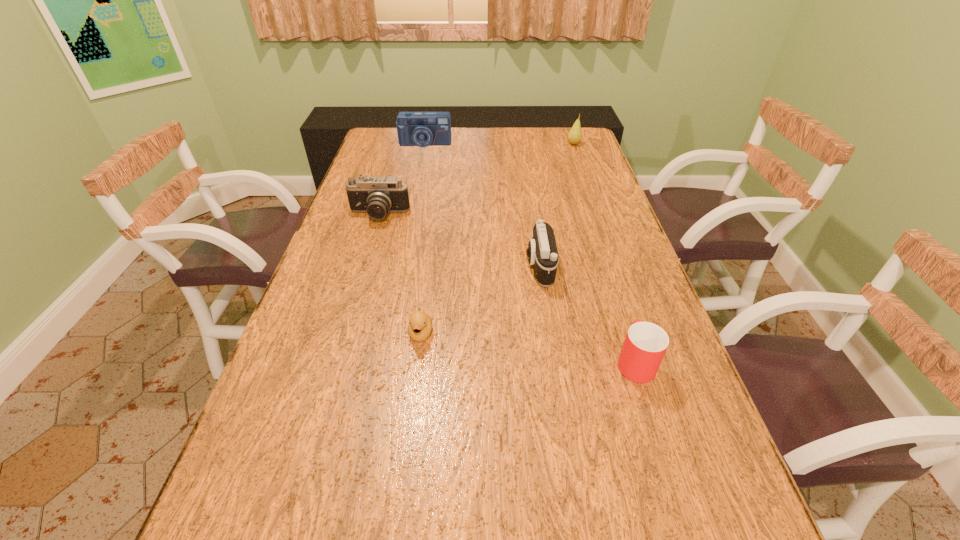
Locate an element on the screen. This screenshot has width=960, height=540. the farthest camera is located at coordinates (422, 129).

You are a GUI agent. You are given a task and a screenshot of the screen. Output one action in this format:
    pyautogui.click(x=<x>, y=<y>)
    Task: Click on the second nearest camera
    
    Given the screenshot: What is the action you would take?
    pyautogui.click(x=376, y=195)

This screenshot has width=960, height=540. Find the location of `pear`. pear is located at coordinates (574, 136).

The width and height of the screenshot is (960, 540). I want to click on the rightmost camera, so click(542, 253).

Identify the location of the fourth farthest object. (542, 253).

Image resolution: width=960 pixels, height=540 pixels. Find the location of `cup`. cup is located at coordinates (645, 344).

The image size is (960, 540). I want to click on the shortest object, so click(420, 324).

Where is `vacant point located on the lens of the farthest camera`? vacant point located on the lens of the farthest camera is located at coordinates (416, 188).

Locate an element on the screen. Image resolution: width=960 pixels, height=540 pixels. vacant space situated on the front-facing side of the fourth nearest object is located at coordinates (368, 252).

The height and width of the screenshot is (540, 960). I want to click on free space located 0.150m on the left of the pear, so click(528, 144).